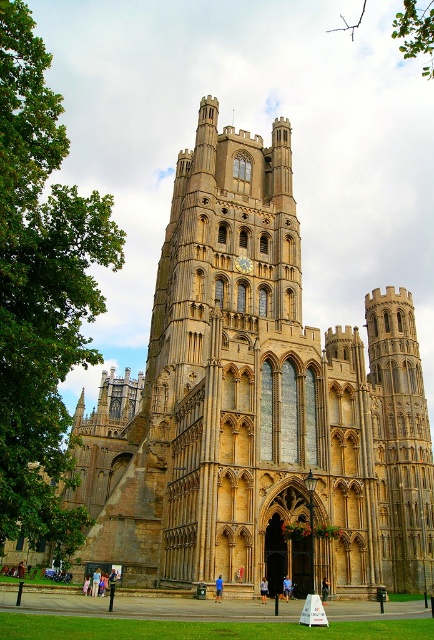
You are a tourist standing at the base of the Ely Cathedral. You want to take a photo that includes both the green leafy tree at left and the gold metallic clock at center. Can you fit both in your camera frame if your camera has a maximum horizontal field of view of 30 meters?

The distance between the green leafy tree at left and the gold metallic clock at center is 38.39 meters. Since the camera can only capture 30 meters horizontally, you cannot fit both in the frame.

You are an architect visiting Ely Cathedral and want to compare the sizes of the green leafy tree at left and the green leafy branch at upper center. Which one has a smaller width?

The green leafy tree at left has a smaller width than the green leafy branch at upper center.

You are standing at the entrance of the Ely Cathedral and want to find the golden stone church at center. According to the coordinates provided, in which direction should you move relative to your current position?

The golden stone church at center is located at coordinates point [257,403], which means it is positioned to the right and slightly forward from your current position at the entrance. Move towards the right and forward to reach it.